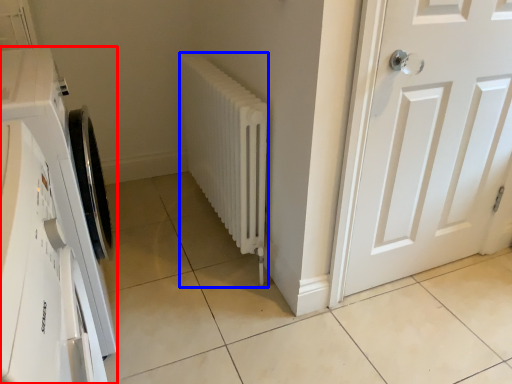
Question: Among these objects, which one is farthest to the camera, washing machine (highlighted by a red box) or radiator (highlighted by a blue box)?

Choices:
 (A) washing machine
 (B) radiator

Answer: (B)